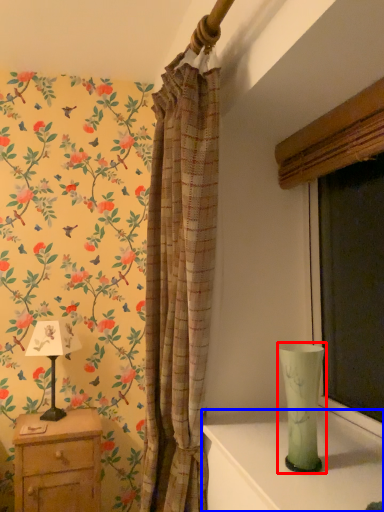
Question: Which point is closer to the camera, glass vase (highlighted by a red box) or table (highlighted by a blue box)?

Choices:
 (A) glass vase
 (B) table

Answer: (B)